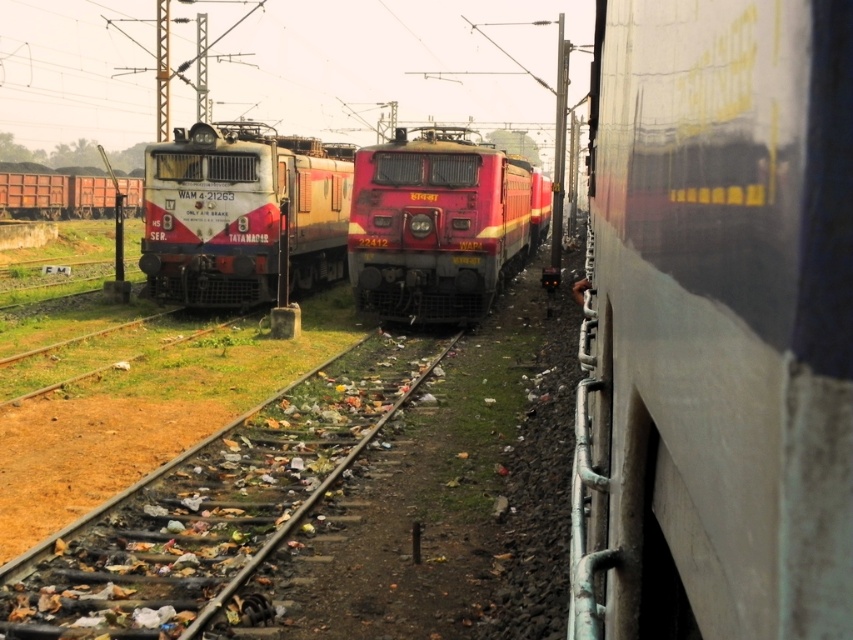
You are a railway inspector standing at the edge of the tracks. You see the matte red locomotive at center and the matte red train at center. Which one is closer to you?

The matte red locomotive at center is closer to the viewer than the matte red train at center.

You are a railway engineer inspecting the scene. There is a point marked at coordinate (241, 212). Which object does this point correspond to?

The point at coordinate (241, 212) corresponds to the matte red locomotive at center.

You are a railway engineer assessing the space between two parallel tracks. You notice the matte red locomotive at center and the matte red train at center. Which one requires more space to maneuver between the tracks?

The matte red train at center requires more space to maneuver between the tracks since it is larger than the matte red locomotive at center.